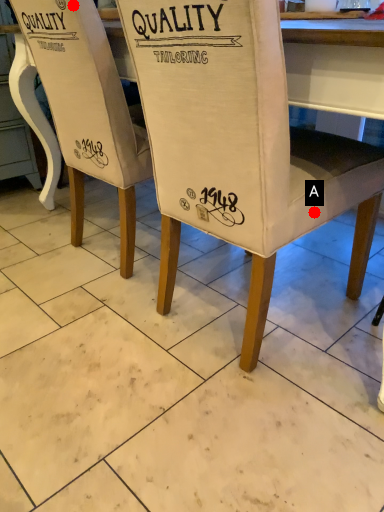
Question: Two points are circled on the image, labeled by A and B beside each circle. Which point is closer to the camera taking this photo?

Choices:
 (A) A is closer
 (B) B is closer

Answer: (A)